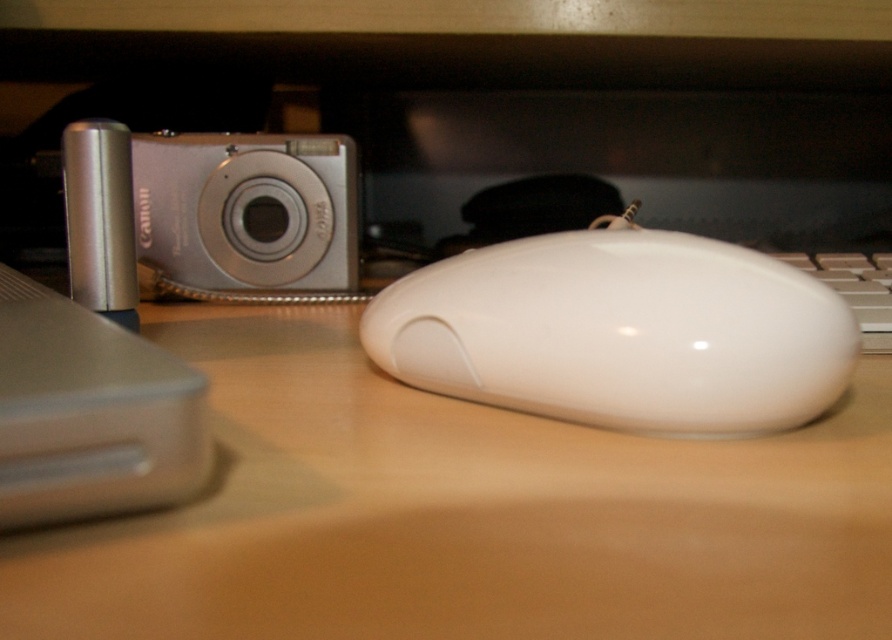
You have two white mice on your desk, a white matte mouse at center and a white glossy mouse at center. Which one is wider?

The white matte mouse at center is wider than the white glossy mouse at center.

You are setting up a workspace and need to place the white glossy mouse at center and the white plastic keyboard at right on your desk. Based on their sizes, which object requires more horizontal space?

The white glossy mouse at center might require more horizontal space than the white plastic keyboard at right since it is wider.